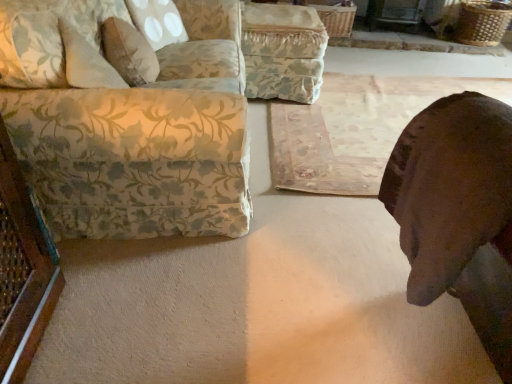
Question: From the image's perspective, relative to rustic wooden mat at center, is floral fabric ottoman at center above or below?

Choices:
 (A) below
 (B) above

Answer: (B)

Question: Is floral fabric ottoman at center bigger or smaller than rustic wooden mat at center?

Choices:
 (A) big
 (B) small

Answer: (B)

Question: Which of these objects is positioned farthest from the floral fabric ottoman at center?

Choices:
 (A) fluffy beige pillow at upper left
 (B) floral fabric couch at left
 (C) brown leather dog at lower right
 (D) rustic wooden mat at center

Answer: (C)

Question: Which is nearer to the fluffy beige pillow at upper left?

Choices:
 (A) brown leather dog at lower right
 (B) floral fabric couch at left
 (C) rustic wooden mat at center
 (D) floral fabric ottoman at center

Answer: (B)